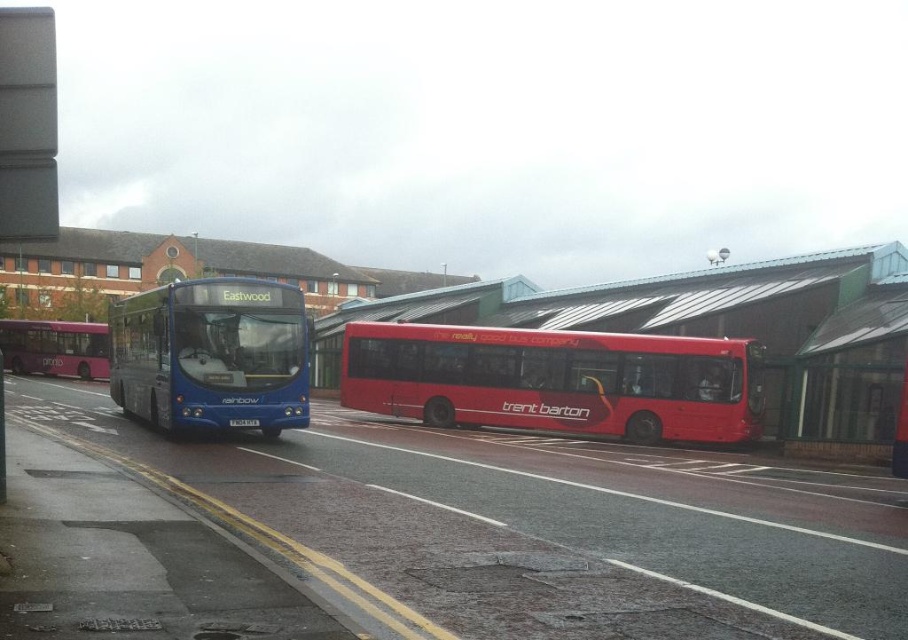
You are a pedestrian standing on the pavement near the shiny red bus at center and the matte blue bus at left. Which bus is casting a shadow over the other?

The shiny red bus at center is positioned under the matte blue bus at left, so the matte blue bus at left is casting a shadow over the shiny red bus at center.

You are a delivery person who needs to place a tall package on the roof of one of the buses. Based on the image, which bus would be safer to place it on considering the height difference between the shiny red bus at center and the matte purple bus at left?

The matte purple bus at left has a greater height than the shiny red bus at center, making it safer to place the tall package on the roof of the matte purple bus at left.